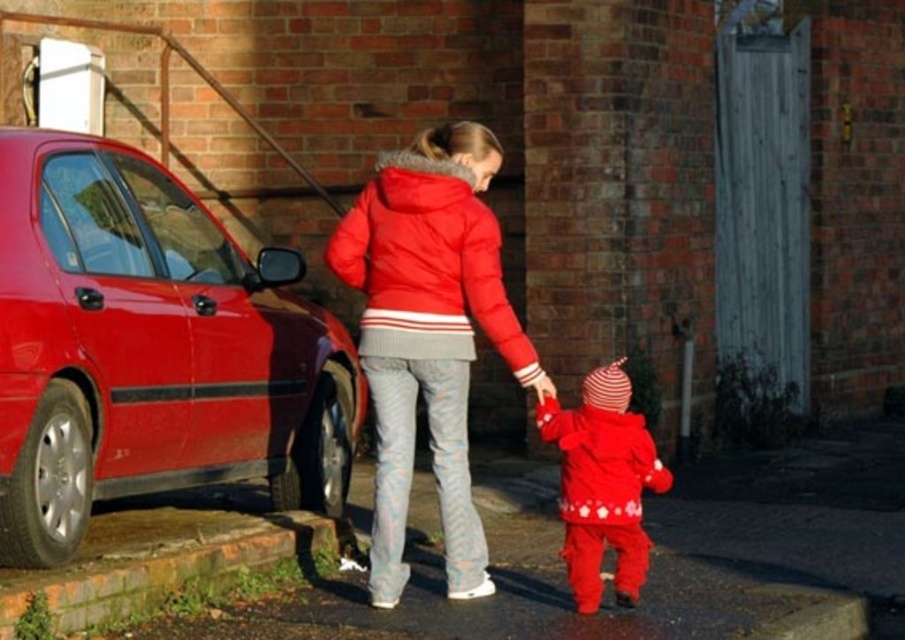
You are standing at the center of the image and want to locate the puffy red jacket at center. Which direction should you look to find it?

The puffy red jacket at center is already at the center of the image, so you don not need to look in any particular direction. It is right in front of you.

You are a photographer trying to capture the woman and child walking away. You notice two red jackets at the center. Which jacket is closer to the camera, the matte red puffer jacket at center or the puffy red jacket at center?

The matte red puffer jacket at center is below the puffy red jacket at center, meaning the puffy red jacket at center is closer to the camera.